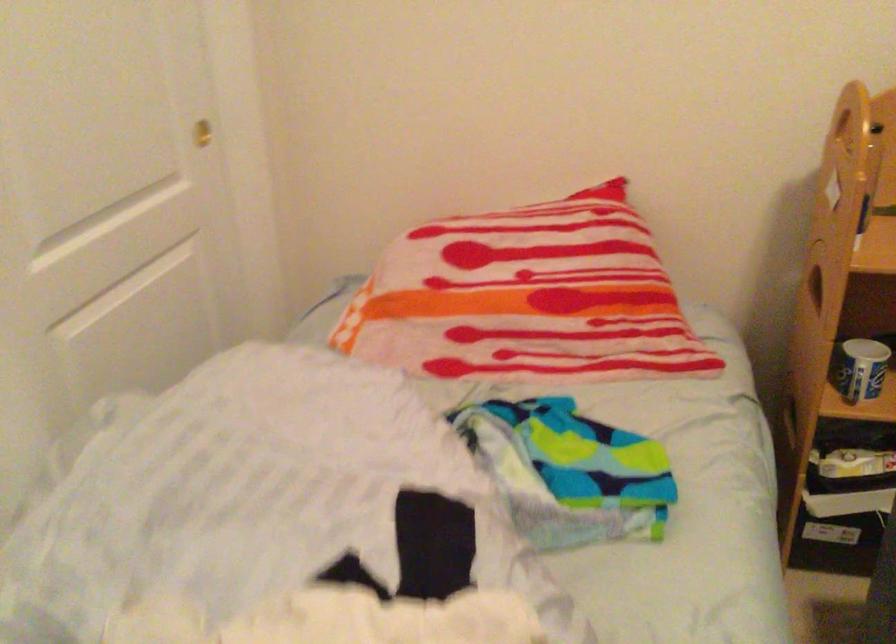
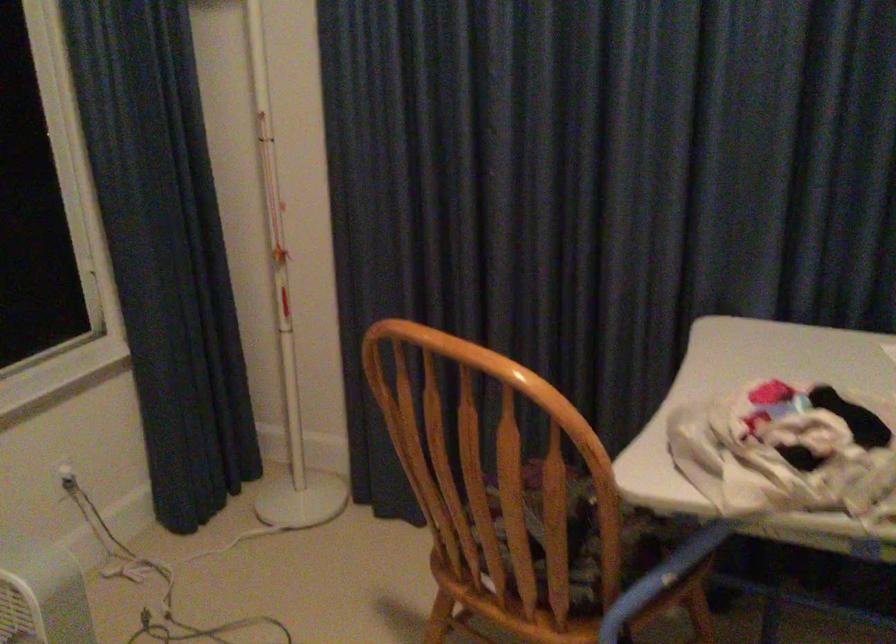
Question: The images are taken continuously from a first-person perspective. In which direction is your viewpoint rotating?

Choices:
 (A) Left
 (B) Right
 (C) Up
 (D) Down

Answer: (B)